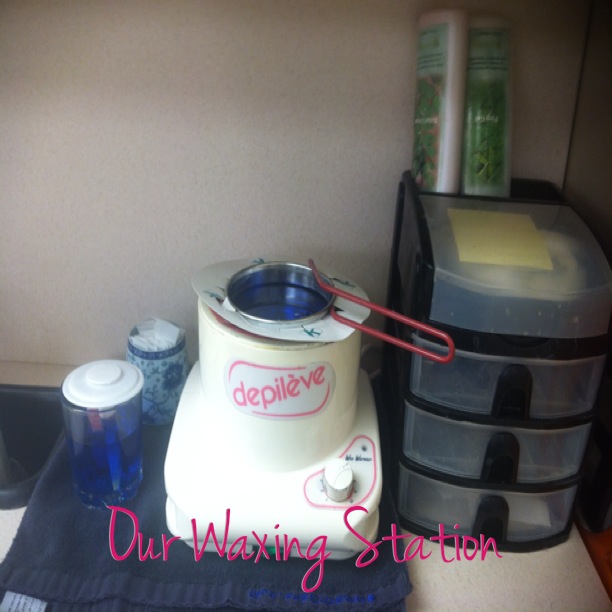
I want to click on storage drawers, so click(542, 452).